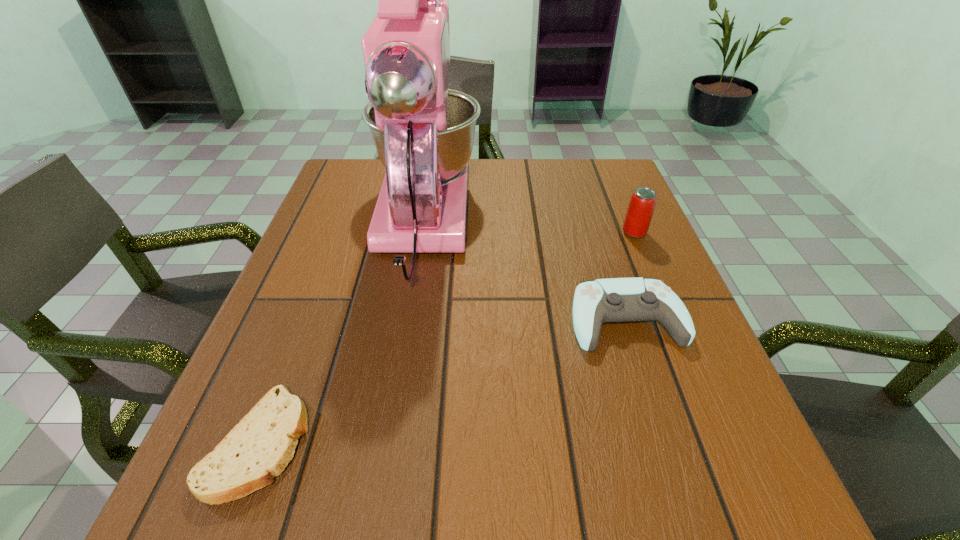
Locate an element on the screen. This screenshot has width=960, height=540. vacant space at the far right corner of the desktop is located at coordinates (587, 164).

Find the location of a particular element. This screenshot has height=540, width=960. unoccupied area between the beer can and the tallest object is located at coordinates (529, 228).

You are a GUI agent. You are given a task and a screenshot of the screen. Output one action in this format:
    pyautogui.click(x=<x>, y=<y>)
    Task: Click on the free spot between the nearest object and the control
    This screenshot has width=960, height=540.
    Given the screenshot: What is the action you would take?
    pyautogui.click(x=443, y=381)

Find the location of a particular element. vacant space in between the control and the mixer is located at coordinates (524, 272).

Find the location of `vacant area between the tallest object and the pita bread`. vacant area between the tallest object and the pita bread is located at coordinates (341, 333).

In order to click on free space between the second tallest object and the mixer in this screenshot , I will do `click(529, 228)`.

Identify the location of free spot between the beer can and the mixer. The height and width of the screenshot is (540, 960). (529, 228).

Locate an element on the screen. free space that is in between the tallest object and the second tallest object is located at coordinates (529, 228).

The height and width of the screenshot is (540, 960). I want to click on empty location between the tallest object and the beer can, so click(529, 228).

Where is `free space that is in between the third tallest object and the second tallest object`? free space that is in between the third tallest object and the second tallest object is located at coordinates (630, 276).